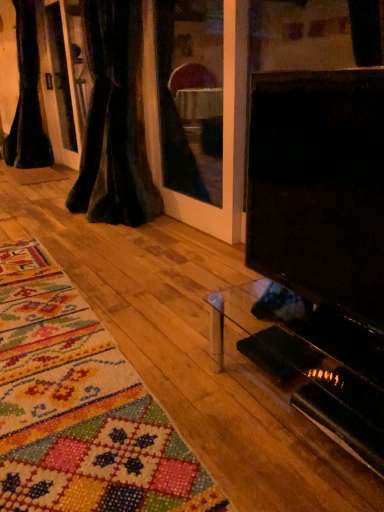
Question: Is velvet dark at left, which appears as the 1th curtain when viewed from the right, a part of black glossy tv at right?

Choices:
 (A) no
 (B) yes

Answer: (A)

Question: From the image's perspective, is black glossy tv at right beneath velvet dark at left, which appears as the 1th curtain when viewed from the right?

Choices:
 (A) yes
 (B) no

Answer: (A)

Question: Is black glossy tv at right positioned behind velvet dark at left, which is the first curtain in front-to-back order?

Choices:
 (A) yes
 (B) no

Answer: (B)

Question: Considering the relative sizes of black glossy tv at right and velvet dark at left, which appears as the 1th curtain when viewed from the right, in the image provided, is black glossy tv at right shorter than velvet dark at left, which appears as the 1th curtain when viewed from the right,?

Choices:
 (A) no
 (B) yes

Answer: (B)

Question: Does black glossy tv at right come in front of velvet dark at left, which is the 2th curtain in back-to-front order?

Choices:
 (A) yes
 (B) no

Answer: (A)

Question: Considering the relative sizes of black glossy tv at right and velvet dark at left, arranged as the 2th curtain when viewed from the left, in the image provided, is black glossy tv at right wider than velvet dark at left, arranged as the 2th curtain when viewed from the left,?

Choices:
 (A) no
 (B) yes

Answer: (B)

Question: From a real-world perspective, is black glossy tv at right physically below black velvet curtain at left, arranged as the first curtain when viewed from the back?

Choices:
 (A) no
 (B) yes

Answer: (B)

Question: Considering the relative sizes of black glossy tv at right and black velvet curtain at left, marked as the 2th curtain in a front-to-back arrangement, in the image provided, is black glossy tv at right taller than black velvet curtain at left, marked as the 2th curtain in a front-to-back arrangement,?

Choices:
 (A) yes
 (B) no

Answer: (B)

Question: From the image's perspective, is black glossy tv at right beneath black velvet curtain at left, the second curtain positioned from the right?

Choices:
 (A) yes
 (B) no

Answer: (A)

Question: Is black glossy tv at right shorter than black velvet curtain at left, the first curtain viewed from the left?

Choices:
 (A) yes
 (B) no

Answer: (A)

Question: Considering the relative positions of black glossy tv at right and black velvet curtain at left, marked as the 2th curtain in a front-to-back arrangement, in the image provided, is black glossy tv at right behind black velvet curtain at left, marked as the 2th curtain in a front-to-back arrangement,?

Choices:
 (A) yes
 (B) no

Answer: (B)

Question: Considering the relative positions of black glossy tv at right and black velvet curtain at left, the first curtain viewed from the left, in the image provided, is black glossy tv at right to the right of black velvet curtain at left, the first curtain viewed from the left, from the viewer's perspective?

Choices:
 (A) no
 (B) yes

Answer: (B)

Question: Considering the relative sizes of black velvet curtain at left, the second curtain positioned from the right, and black glossy tv at right in the image provided, is black velvet curtain at left, the second curtain positioned from the right, bigger than black glossy tv at right?

Choices:
 (A) no
 (B) yes

Answer: (B)